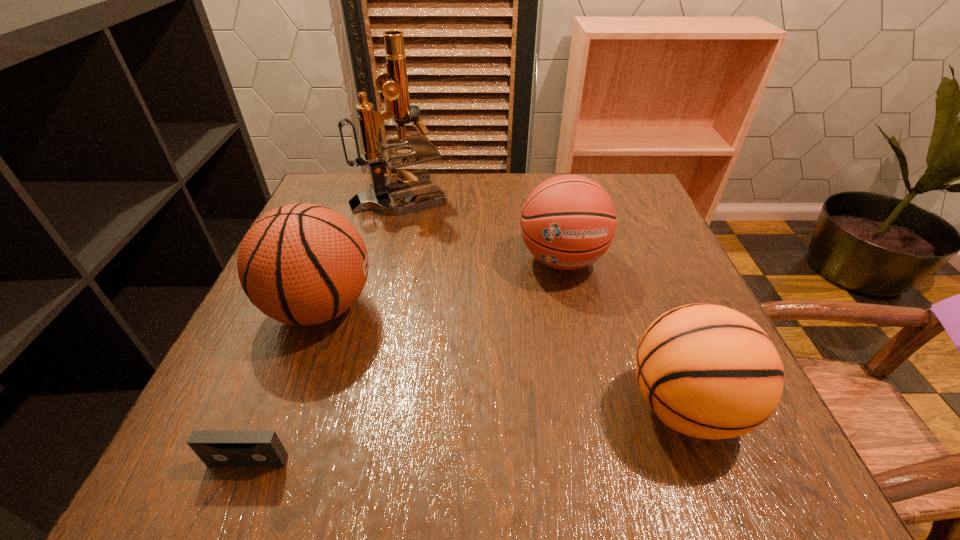
Point out which basketball is positioned as the second nearest to the nearest basketball. Please provide its 2D coordinates. Your answer should be formatted as a tuple, i.e. [(x, y)], where the tuple contains the x and y coordinates of a point satisfying the conditions above.

[(304, 264)]

I want to click on basketball that can be found as the second closest to the leftmost basketball, so click(x=708, y=371).

This screenshot has width=960, height=540. Find the location of `free spot that satisfies the following two spatial constraints: 1. on the side where the inflation valve is located; 2. on the left side of the leftmost basketball`. free spot that satisfies the following two spatial constraints: 1. on the side where the inflation valve is located; 2. on the left side of the leftmost basketball is located at coordinates (283, 406).

The height and width of the screenshot is (540, 960). What are the coordinates of `vacant space that satisfies the following two spatial constraints: 1. on the side where the inflation valve is located; 2. on the right side of the nearest basketball` in the screenshot? It's located at (283, 406).

Locate an element on the screen. The width and height of the screenshot is (960, 540). free spot that satisfies the following two spatial constraints: 1. on the back side of the nearest basketball; 2. at the eyepiece of the tallest object is located at coordinates (603, 194).

Identify the location of free space that satisfies the following two spatial constraints: 1. at the eyepiece of the farthest object; 2. on the front-facing side of the shortest object. This screenshot has width=960, height=540. (332, 461).

The height and width of the screenshot is (540, 960). I want to click on vacant point that satisfies the following two spatial constraints: 1. on the side where the inflation valve is located; 2. on the right side of the leftmost basketball, so click(x=283, y=406).